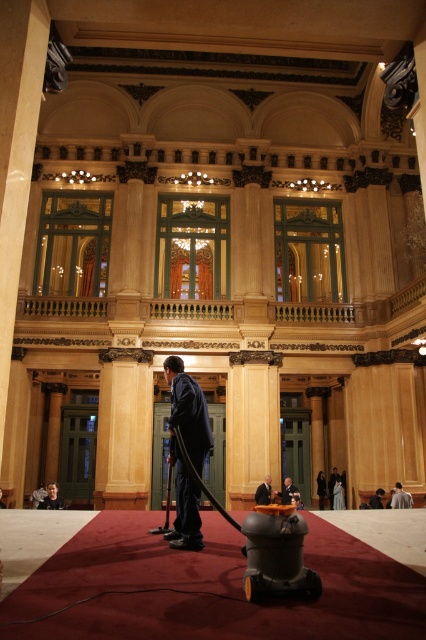
Which is above, dark blue fabric man at center or dark blue fabric suit at center?

dark blue fabric man at center is above.

How distant is dark blue fabric man at center from dark blue fabric suit at center?

dark blue fabric man at center is 76.85 feet from dark blue fabric suit at center.

This screenshot has width=426, height=640. What do you see at coordinates (187, 451) in the screenshot?
I see `dark blue fabric man at center` at bounding box center [187, 451].

Find the location of a particular element. This screenshot has width=426, height=640. dark blue fabric man at center is located at coordinates (187, 451).

Is point (417, 593) positioned in front of point (377, 499)?

Yes.

Does matte black vacuum cleaner at center appear on the left side of dark blue fabric suit at center?

Yes, matte black vacuum cleaner at center is to the left of dark blue fabric suit at center.

You are a GUI agent. You are given a task and a screenshot of the screen. Output one action in this format:
    pyautogui.click(x=<x>, y=<y>)
    Task: Click on the matte black vacuum cleaner at center
    This screenshot has height=640, width=426.
    Given the screenshot: What is the action you would take?
    pyautogui.click(x=210, y=588)

Does matte black vacuum cleaner at center lie in front of dark gray fabric jacket at lower right?

Yes, matte black vacuum cleaner at center is in front of dark gray fabric jacket at lower right.

Can you confirm if matte black vacuum cleaner at center is positioned below dark gray fabric jacket at lower right?

Actually, matte black vacuum cleaner at center is above dark gray fabric jacket at lower right.

Who is more forward, (227, 620) or (400, 497)?

Point (227, 620) is in front.

Where is `matte black vacuum cleaner at center`? matte black vacuum cleaner at center is located at coordinates (210, 588).